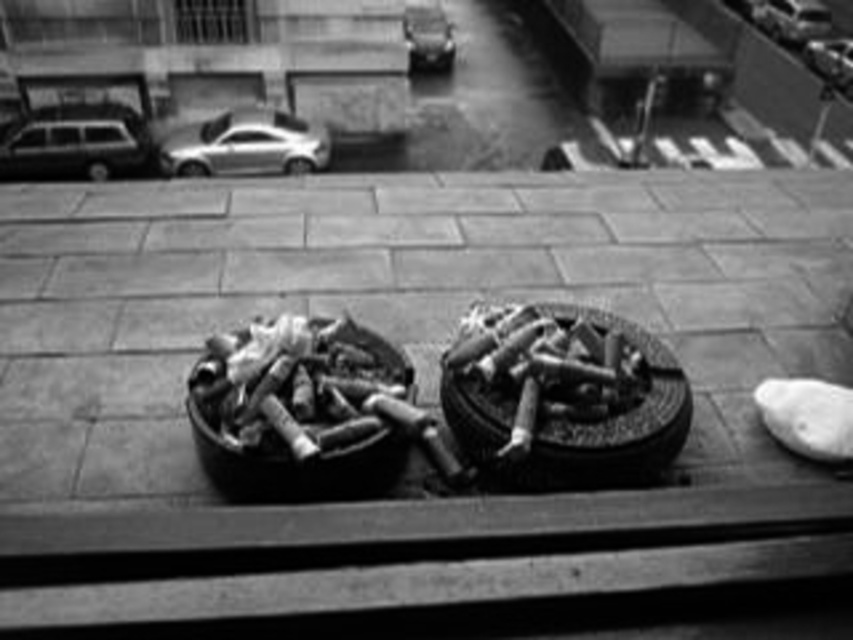
Question: Does metallic silver van at left appear on the left side of shiny silver sedan at upper right?

Choices:
 (A) no
 (B) yes

Answer: (B)

Question: Estimate the real-world distances between objects in this image. Which object is farther from the shiny silver sedan at upper right?

Choices:
 (A) shiny metallic car at upper center
 (B) metallic silver car at upper center
 (C) shiny silver sedan at upper center

Answer: (C)

Question: Which object is the closest to the shiny silver sedan at upper center?

Choices:
 (A) metallic silver car at upper center
 (B) metallic silver van at left
 (C) shiny silver sedan at upper right

Answer: (B)

Question: From the image, what is the correct spatial relationship of metallic silver van at left in relation to metallic silver car at upper center?

Choices:
 (A) below
 (B) above

Answer: (A)

Question: Which point is closer to the camera?

Choices:
 (A) shiny metallic car at upper center
 (B) metallic silver van at left
 (C) shiny silver sedan at upper center

Answer: (C)

Question: Can you confirm if metallic silver van at left is positioned above shiny silver sedan at upper right?

Choices:
 (A) yes
 (B) no

Answer: (B)